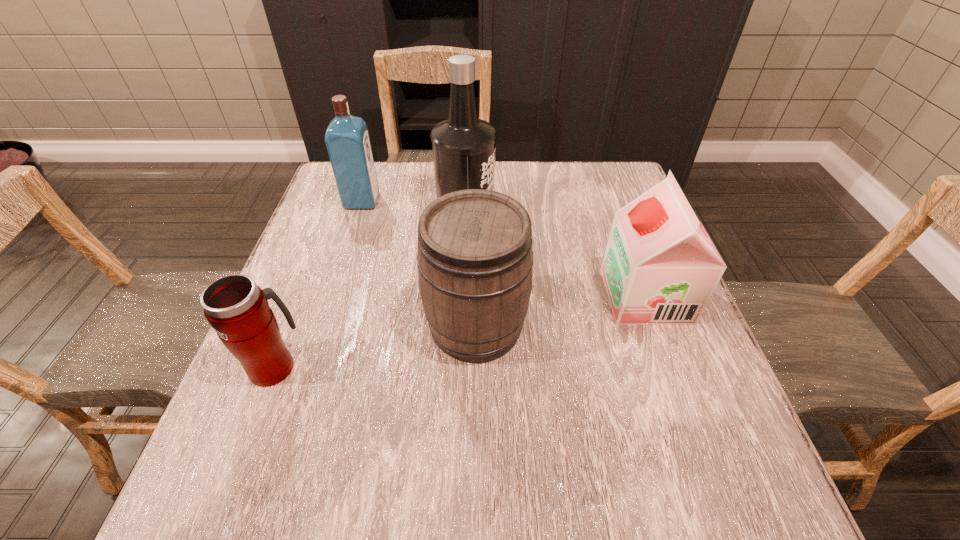
Find the location of a particular element. The width and height of the screenshot is (960, 540). free space located with the cap open on the rightmost object is located at coordinates (581, 295).

The width and height of the screenshot is (960, 540). Identify the location of blank space located 0.120m with the cap open on the rightmost object. (553, 295).

In order to click on vacant space located on the side with the handle of the thermos bottle in this screenshot , I will do `click(324, 239)`.

Identify the location of vacant space located on the side with the handle of the thermos bottle. (331, 219).

You are a GUI agent. You are given a task and a screenshot of the screen. Output one action in this format:
    pyautogui.click(x=<x>, y=<y>)
    Task: Click on the vacant space positioned 0.220m on the side with the handle of the thermos bottle
    The image size is (960, 540).
    Given the screenshot: What is the action you would take?
    pyautogui.click(x=313, y=267)

Where is `liquor that is at the left edge`? The height and width of the screenshot is (540, 960). liquor that is at the left edge is located at coordinates (347, 139).

What are the coordinates of `thermos bottle located at the left edge` in the screenshot? It's located at [x=238, y=309].

Image resolution: width=960 pixels, height=540 pixels. I want to click on object at the right edge, so click(660, 267).

This screenshot has width=960, height=540. I want to click on object present at the far left corner, so [347, 139].

The width and height of the screenshot is (960, 540). What are the coordinates of `vacant space at the far edge` in the screenshot? It's located at (551, 199).